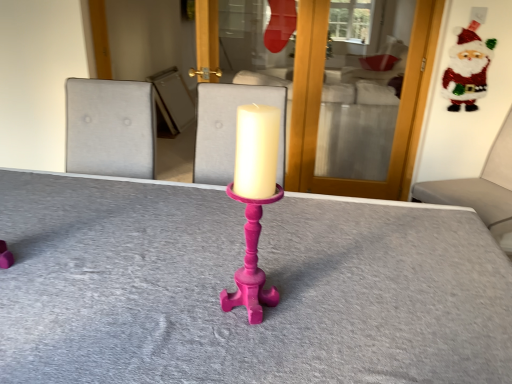
Locate an element on the screen. free location in front of matte pink candle holder at center is located at coordinates (246, 354).